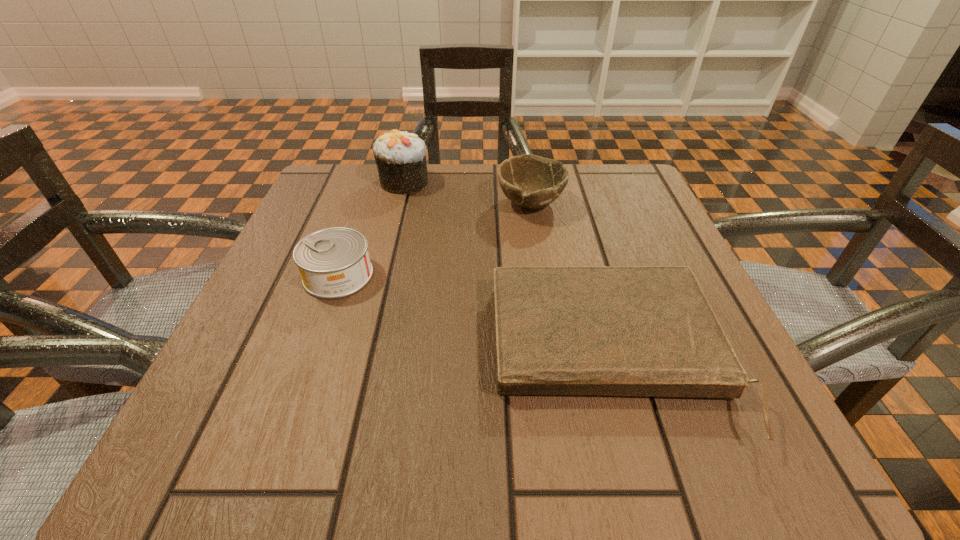
At what (x,y) coordinates should I click in order to perform the action: click on cupcake situated at the left edge. Please return your answer as a coordinate pair (x, y). This screenshot has width=960, height=540. Looking at the image, I should click on (400, 157).

The image size is (960, 540). I want to click on can present at the left edge, so click(x=334, y=262).

Find the location of a particular element. Image resolution: width=960 pixels, height=540 pixels. object that is at the right edge is located at coordinates (650, 331).

Find the location of `object at the far left corner`. object at the far left corner is located at coordinates coord(400,157).

In order to click on object located at the near right corner in this screenshot , I will do `click(650, 331)`.

At what (x,y) coordinates should I click in order to perform the action: click on vacant space at the far edge of the desktop. Please return your answer as a coordinate pair (x, y). The height and width of the screenshot is (540, 960). Looking at the image, I should click on click(x=478, y=217).

Where is `vacant area at the near edge`? vacant area at the near edge is located at coordinates (486, 430).

Locate an element on the screen. This screenshot has height=540, width=960. vacant region at the left edge is located at coordinates (257, 324).

At what (x,y) coordinates should I click in order to perform the action: click on vacant space at the right edge. Please return your answer as a coordinate pair (x, y). The height and width of the screenshot is (540, 960). Looking at the image, I should click on (680, 260).

Locate an element on the screen. The height and width of the screenshot is (540, 960). vacant space at the far left corner of the desktop is located at coordinates (377, 181).